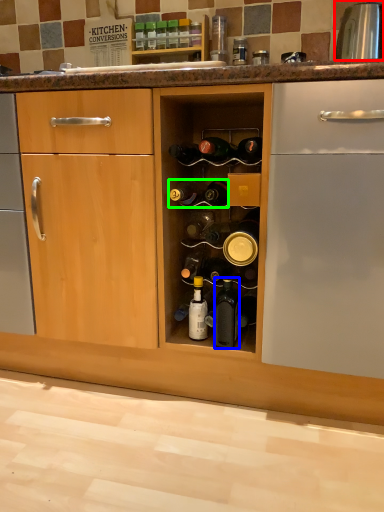
Question: Based on their relative distances, which object is farther from appliance (highlighted by a red box)? Choose from bottle (highlighted by a blue box) and bottle (highlighted by a green box).

Choices:
 (A) bottle
 (B) bottle

Answer: (A)